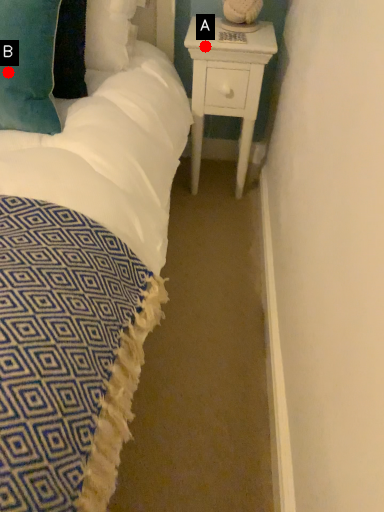
Question: Two points are circled on the image, labeled by A and B beside each circle. Which point appears farthest from the camera in this image?

Choices:
 (A) A is further
 (B) B is further

Answer: (A)